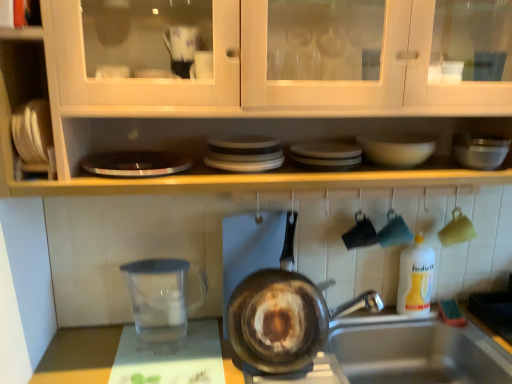
Locate an element on the screen. The image size is (512, 384). vacant space situated above transparent glass water at lower left (from a real-world perspective) is located at coordinates (169, 347).